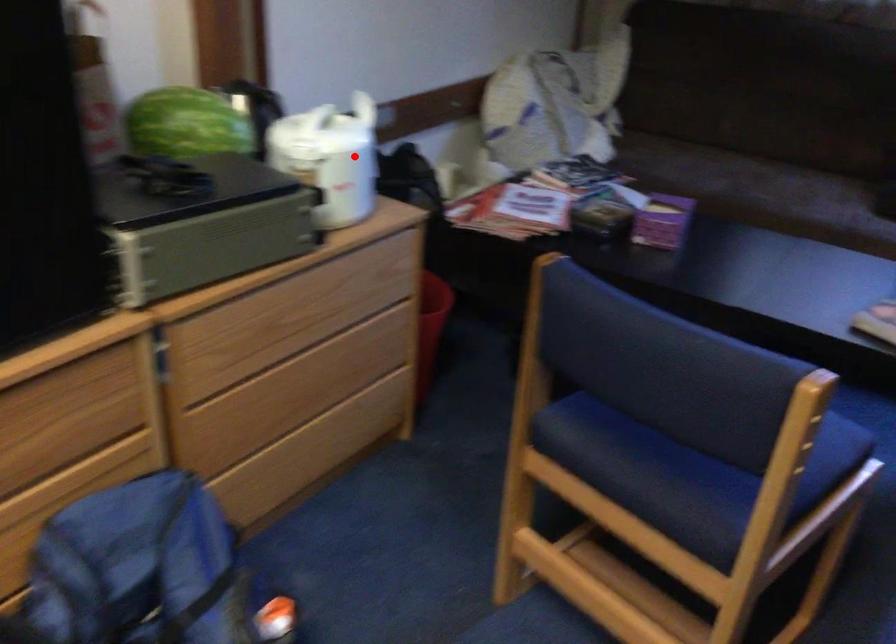
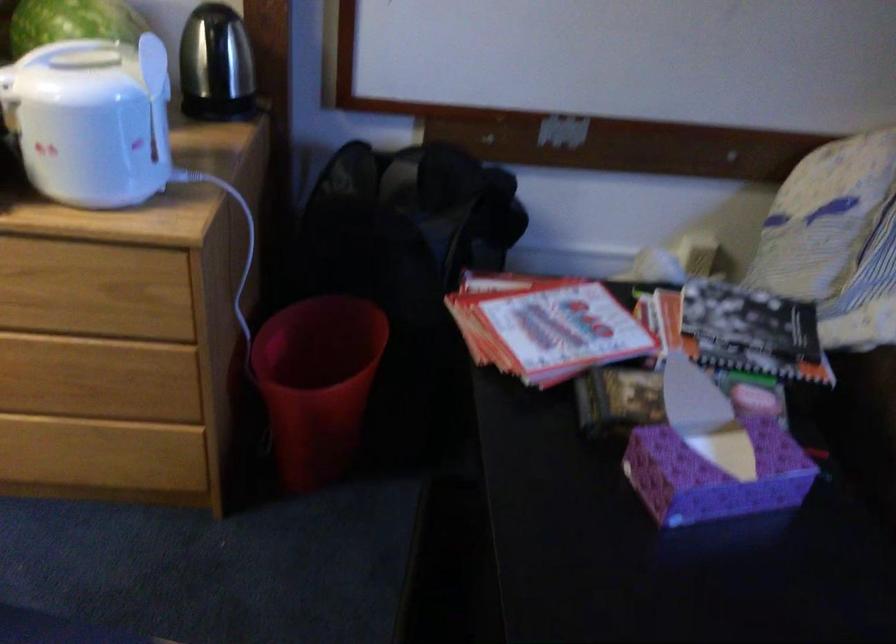
Question: A red point is marked in image1. In image2, is the corresponding 3D point closer to the camera or farther? Reply with the corresponding letter.

Choices:
 (A) The corresponding 3D point is closer.
 (B) The corresponding 3D point is farther.

Answer: (A)